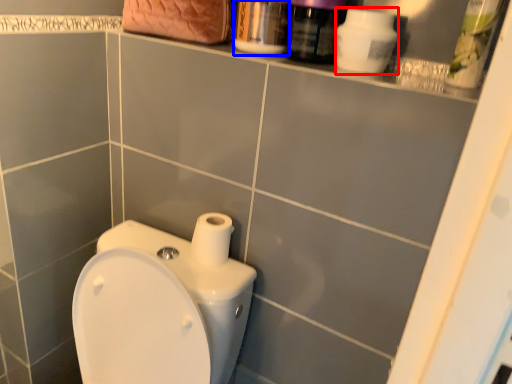
Question: Among these objects, which one is nearest to the camera, cleaning product (highlighted by a red box) or mouthwash (highlighted by a blue box)?

Choices:
 (A) cleaning product
 (B) mouthwash

Answer: (A)